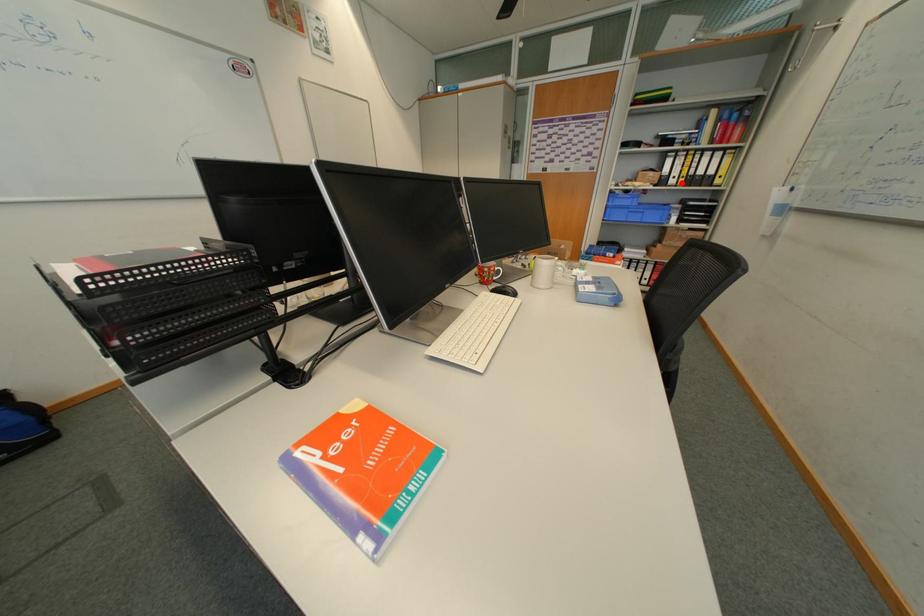
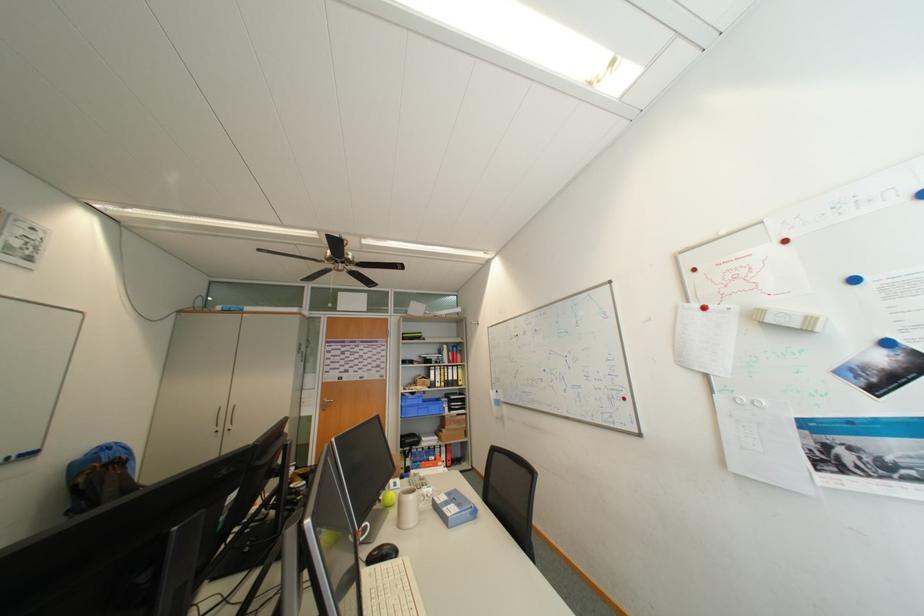
The point at the highlighted location is marked in the first image. Where is the corresponding point in the second image?

(447, 386)